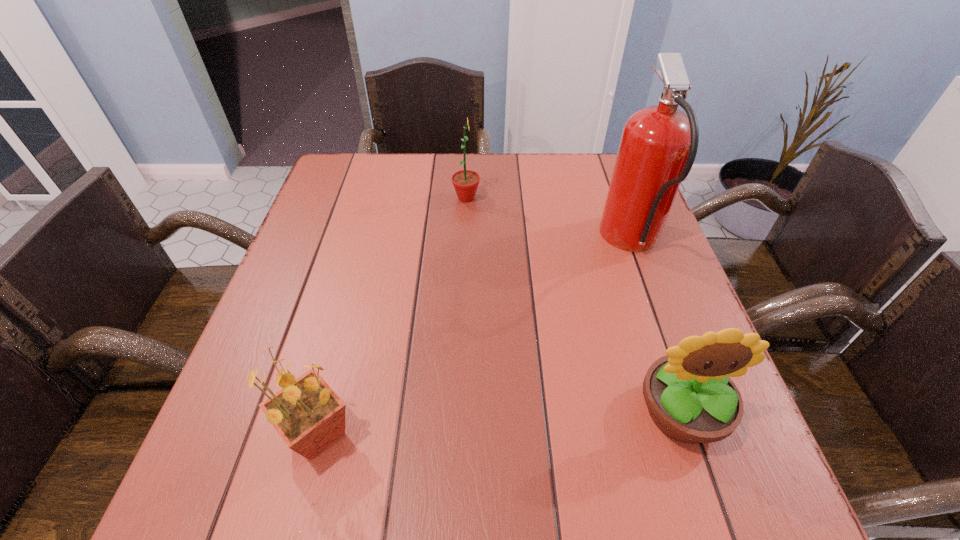
Find the location of a particular element. Image resolution: width=960 pixels, height=540 pixels. free region at the right edge is located at coordinates (676, 314).

Identify the location of vacant space at the far right corner of the desktop. The image size is (960, 540). (602, 164).

You are a GUI agent. You are given a task and a screenshot of the screen. Output one action in this format:
    pyautogui.click(x=<x>, y=<y>)
    Task: Click on the unoccupied position between the rightmost sunflower and the leftmost object
    Image resolution: width=960 pixels, height=540 pixels.
    Given the screenshot: What is the action you would take?
    pyautogui.click(x=499, y=422)

Where is `empty location between the leftmost sunflower and the second sunflower from left to right`? The height and width of the screenshot is (540, 960). empty location between the leftmost sunflower and the second sunflower from left to right is located at coordinates (393, 316).

Find the location of a particular element. The image size is (960, 540). free space between the leftmost sunflower and the rightmost sunflower is located at coordinates (499, 422).

The width and height of the screenshot is (960, 540). In order to click on unoccupied area between the rightmost sunflower and the third object from right to left in this screenshot , I will do `click(573, 305)`.

Identify the location of vacant area between the farthest sunflower and the rightmost sunflower. (573, 305).

Locate an element on the screen. empty location between the fire extinguisher and the second sunflower from left to right is located at coordinates (549, 220).

Where is `vacant space that is in between the leftmost object and the third object from right to left`? vacant space that is in between the leftmost object and the third object from right to left is located at coordinates (393, 316).

Identify the location of blank region between the third object from right to left and the leftmost sunflower. This screenshot has width=960, height=540. (393, 316).